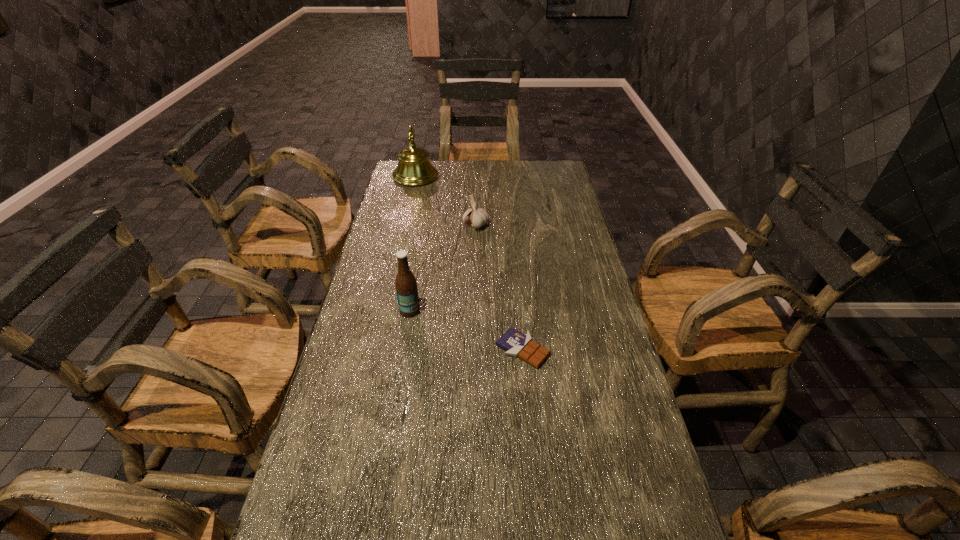
Identify the location of unoccupied position between the bell and the second nearest object. (413, 244).

This screenshot has height=540, width=960. I want to click on free area in between the farthest object and the third tallest object, so click(445, 201).

You are a GUI agent. You are given a task and a screenshot of the screen. Output one action in this format:
    pyautogui.click(x=<x>, y=<y>)
    Task: Click on the free point between the rightmost object and the beer bottle
    
    Given the screenshot: What is the action you would take?
    pyautogui.click(x=467, y=330)

Where is `free space between the shortest object and the second object from right to left`? The image size is (960, 540). free space between the shortest object and the second object from right to left is located at coordinates (499, 287).

I want to click on free space between the shortest object and the farthest object, so click(x=469, y=263).

What are the coordinates of `vacant space that's between the third farthest object and the chocolate bar` in the screenshot? It's located at (467, 330).

Find the location of `free space between the bell and the beer bottle`. free space between the bell and the beer bottle is located at coordinates (413, 244).

Find the location of a particular element. free area in between the second nearest object and the garlic is located at coordinates (443, 268).

This screenshot has width=960, height=540. I want to click on the second closest object to the nearest object, so click(477, 217).

The height and width of the screenshot is (540, 960). I want to click on object that can be found as the second closest to the nearest object, so click(x=477, y=217).